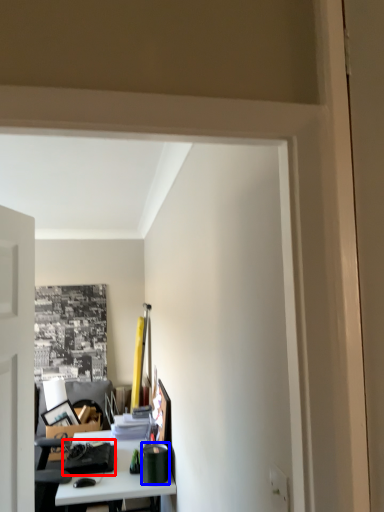
Question: Which object is closer to the camera taking this photo, stationery (highlighted by a red box) or stationery (highlighted by a blue box)?

Choices:
 (A) stationery
 (B) stationery

Answer: (B)